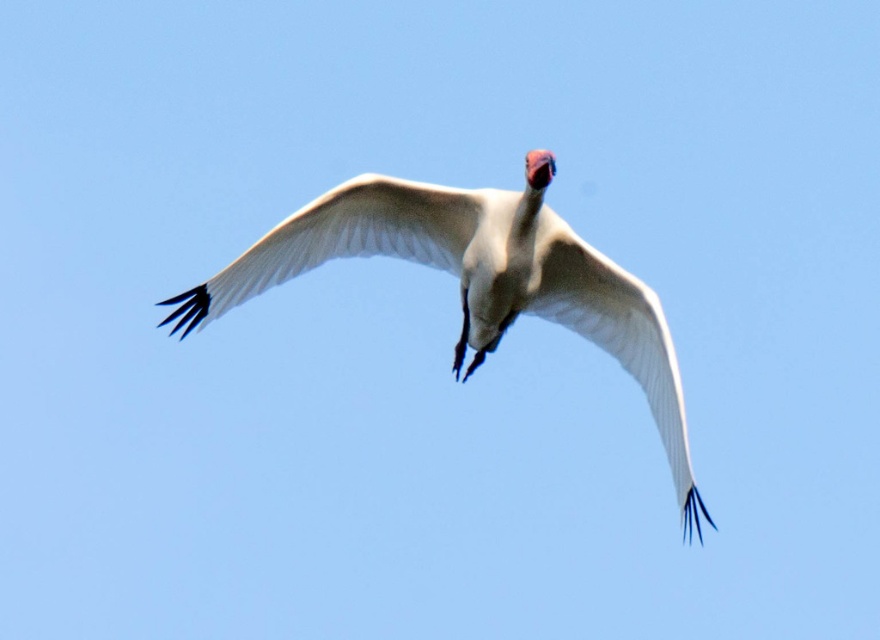
You are an ornithologist observing a bird in flight. You notice a point at coordinates (x=477, y=280). What does this point correspond to?

The point at (x=477, y=280) corresponds to the white feathered bird at center.

You are a photographer trying to capture the bird in flight. You notice two points on the bird that you want to focus on. The first point is at coordinates point (650, 323), and the second is at point (431, 228). Which of these points is closer to the camera?

Point (650, 323) is closer to the viewer than point (431, 228), so the photographer should focus on point (650, 323) to capture the closer point.

You are standing in a field and see a white feathered bird at center flying above you. If you want to take a photo of it with your smartphone camera, which has a maximum zoom range of 10 feet, will you be able to capture it clearly without moving closer?

The white feathered bird at center is 30.74 feet away from viewer. Since the smartphone camera has a maximum zoom range of 10 feet, it cannot capture the bird clearly at this distance. You would need to move closer or use a camera with a longer zoom range.